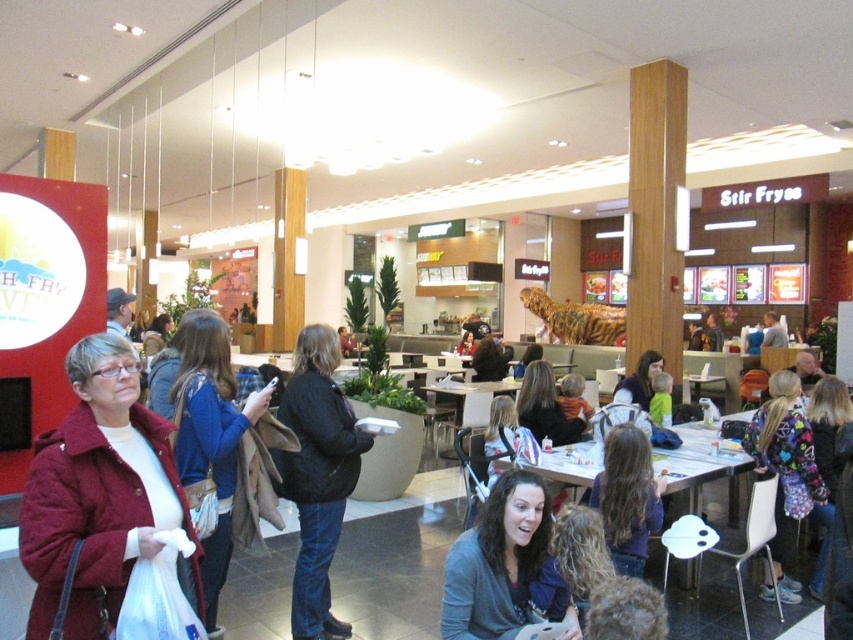
Is dark gray sweater at center bigger than multicolored fleece jacket at lower right?

Actually, dark gray sweater at center might be smaller than multicolored fleece jacket at lower right.

The image size is (853, 640). Describe the element at coordinates (497, 561) in the screenshot. I see `dark gray sweater at center` at that location.

Is point (480, 563) closer to camera compared to point (778, 451)?

Yes, point (480, 563) is closer to viewer.

In order to click on dark gray sweater at center in this screenshot , I will do (497, 561).

Can you confirm if maroon coat at left is taller than dark purple sweater at center?

Correct, maroon coat at left is much taller as dark purple sweater at center.

Where is `maroon coat at left`? This screenshot has width=853, height=640. maroon coat at left is located at coordinates (97, 493).

The height and width of the screenshot is (640, 853). Find the location of `maroon coat at left`. maroon coat at left is located at coordinates (97, 493).

Does multicolored fleece jacket at lower right have a greater height compared to dark purple sweater at center?

Indeed, multicolored fleece jacket at lower right has a greater height compared to dark purple sweater at center.

Between multicolored fleece jacket at lower right and dark purple sweater at center, which one is positioned lower?

Positioned lower is multicolored fleece jacket at lower right.

You are a GUI agent. You are given a task and a screenshot of the screen. Output one action in this format:
    pyautogui.click(x=<x>, y=<y>)
    Task: Click on the multicolored fleece jacket at lower right
    
    Given the screenshot: What is the action you would take?
    pyautogui.click(x=784, y=472)